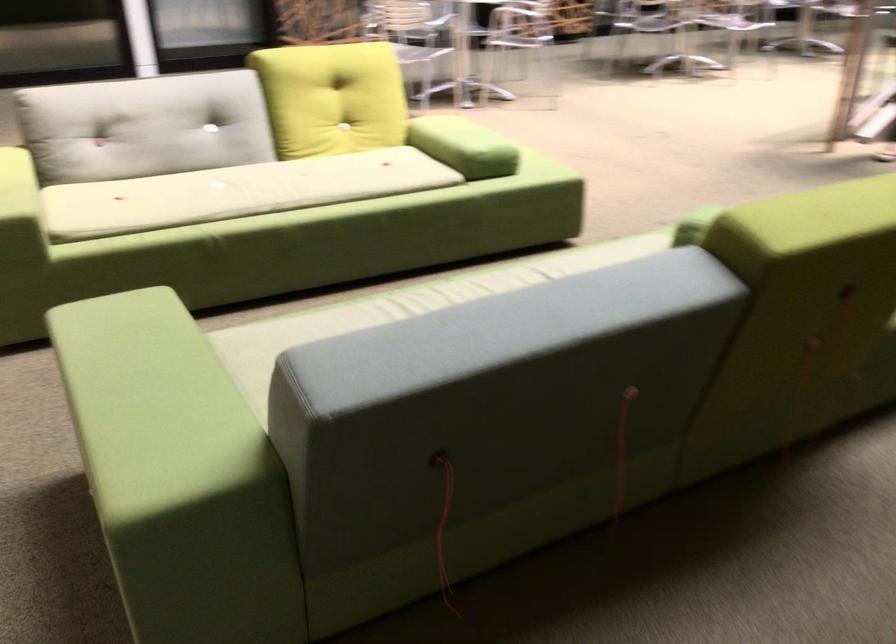
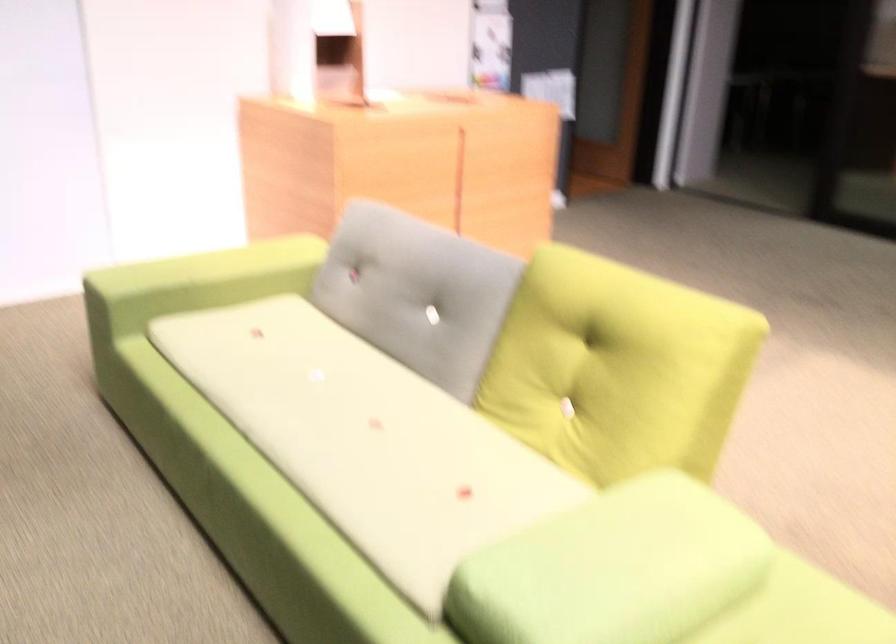
In the second image, find the point that corresponds to pixel 325 174 in the first image.

(366, 439)